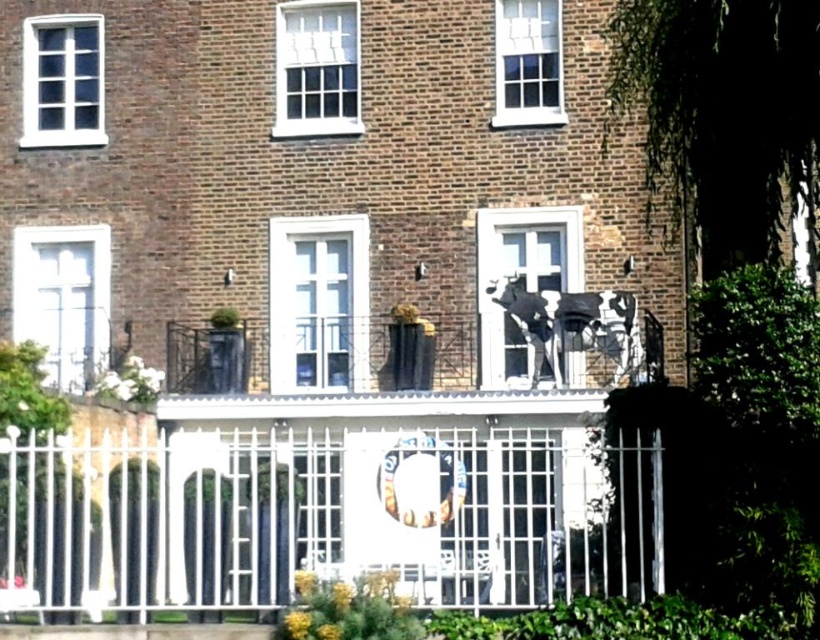
You are standing at the base of the building and see the white glass cross at left and the two potted plants on the balcony. How far apart are these two objects from each other?

The white glass cross at left and the two potted plants on the balcony are 76.73 feet apart.

Consider the image. You are standing in front of the building and want to hang a new wind chime. The wind chime requires a hook that can support its weight. Which object, the white glass cross at left or the white painted metal balcony at center, is more suitable for hanging the wind chime based on their height?

The white glass cross at left is much taller than the white painted metal balcony at center, so it would be more suitable for hanging the wind chime as it provides a higher mounting point.

You are a window cleaner standing on the ground floor of the building. You need to reach the white glass window at center and the white painted metal balcony at center. Given that your ladder can extend up to 5 feet, can you safely reach both using the same ladder without moving it?

The white glass window at center and the white painted metal balcony at center are 5.43 feet apart. Since your ladder can only extend up to 5 feet, it is not long enough to safely reach both. You will need to move the ladder or use a longer ladder.